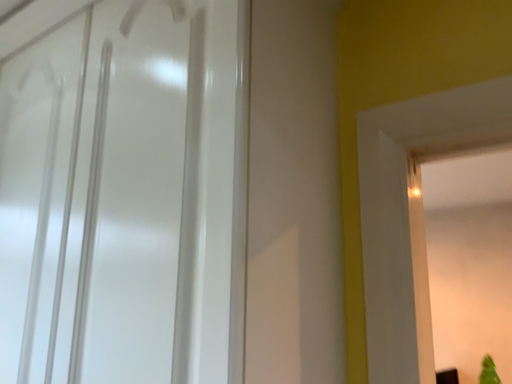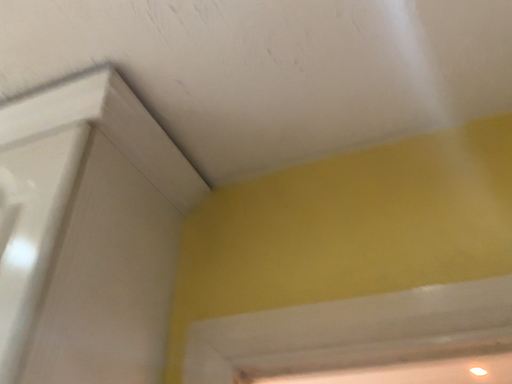
Question: How did the camera likely rotate when shooting the video?

Choices:
 (A) rotated left
 (B) rotated right

Answer: (B)